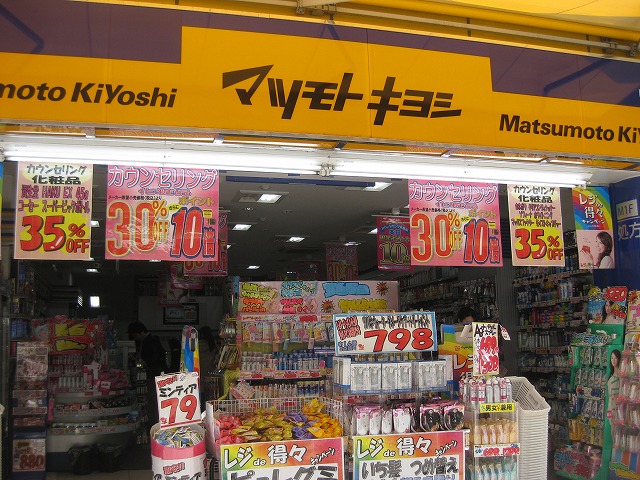
What are the coordinates of `trash bucket` in the screenshot? It's located at (109, 451), (82, 454).